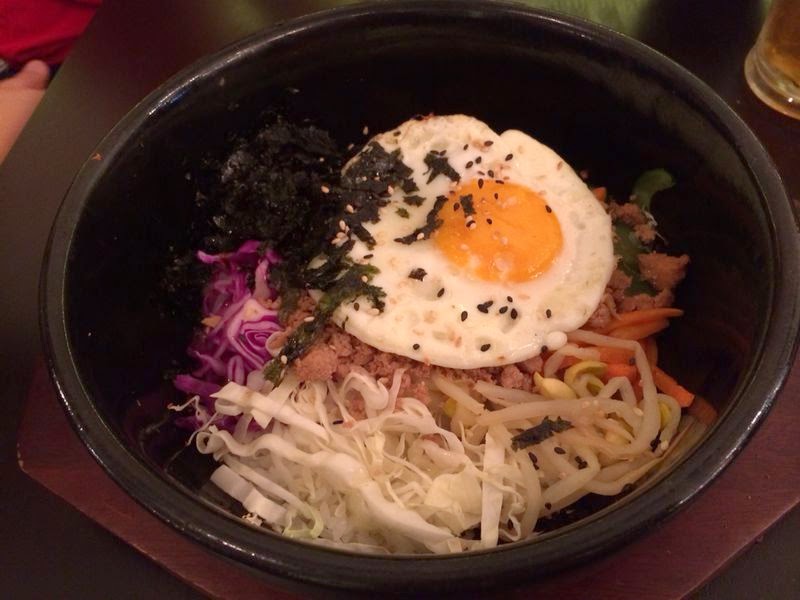
Identify the location of black bowl. (758, 305), (318, 63).